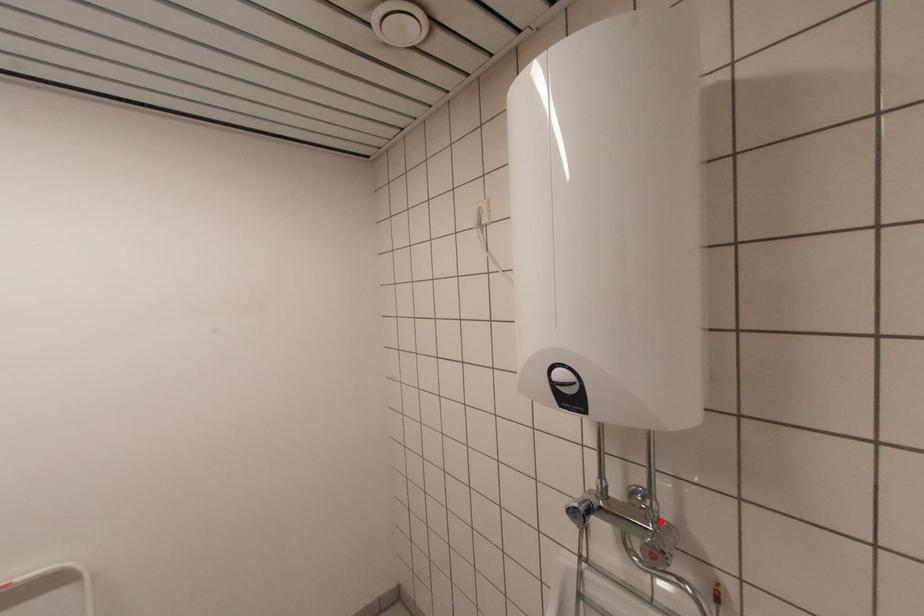
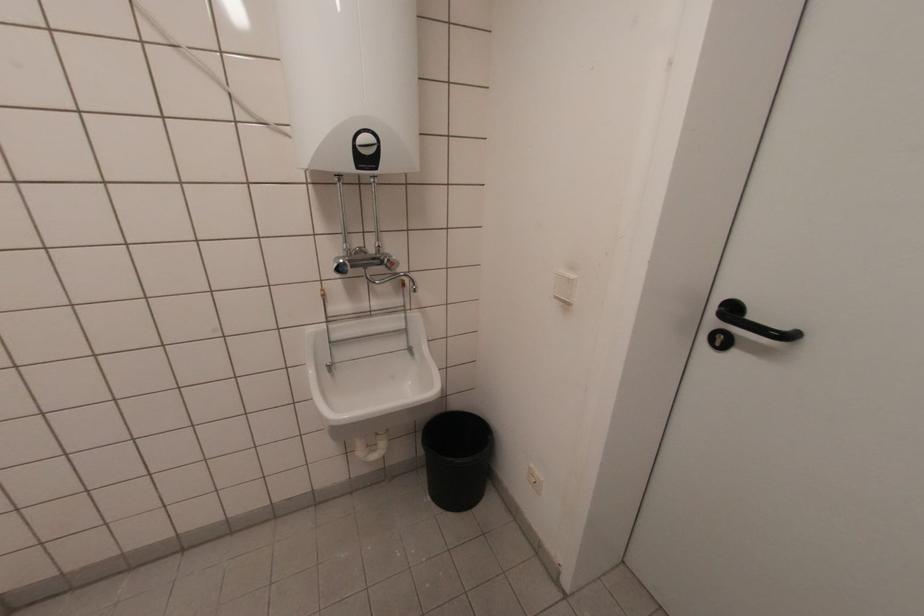
Locate, in the second image, the point that corresponds to the highlighted location in the first image.

(383, 254)